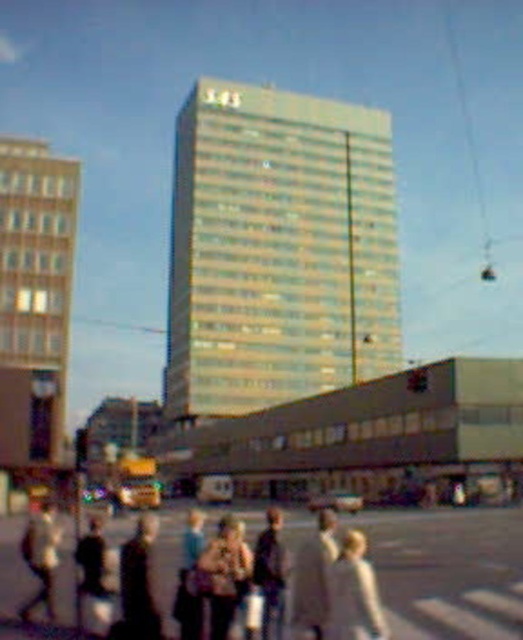
Question: Does light brown leather jacket at lower center have a greater width compared to light beige jacket at lower left?

Choices:
 (A) no
 (B) yes

Answer: (A)

Question: Which object is closer to the camera taking this photo?

Choices:
 (A) light beige jacket at lower center
 (B) light brown leather jacket at lower center
 (C) light beige jacket at lower left
 (D) dark brown leather jacket at center

Answer: (A)

Question: Considering the relative positions of dark gray fabric jacket at lower center and light brown leather jacket at center in the image provided, where is dark gray fabric jacket at lower center located with respect to light brown leather jacket at center?

Choices:
 (A) below
 (B) above

Answer: (B)

Question: Which point is closer to the camera?

Choices:
 (A) light beige jacket at lower left
 (B) light beige pedestrians at lower center
 (C) light brown leather jacket at center
 (D) dark gray sweater at lower left

Answer: (B)

Question: Can you confirm if light beige pedestrians at lower center is bigger than dark brown leather jacket at center?

Choices:
 (A) yes
 (B) no

Answer: (A)

Question: Which object appears farthest from the camera in this image?

Choices:
 (A) metallic silver traffic light at center
 (B) light beige pedestrians at lower center
 (C) light beige fabric bag at center

Answer: (A)